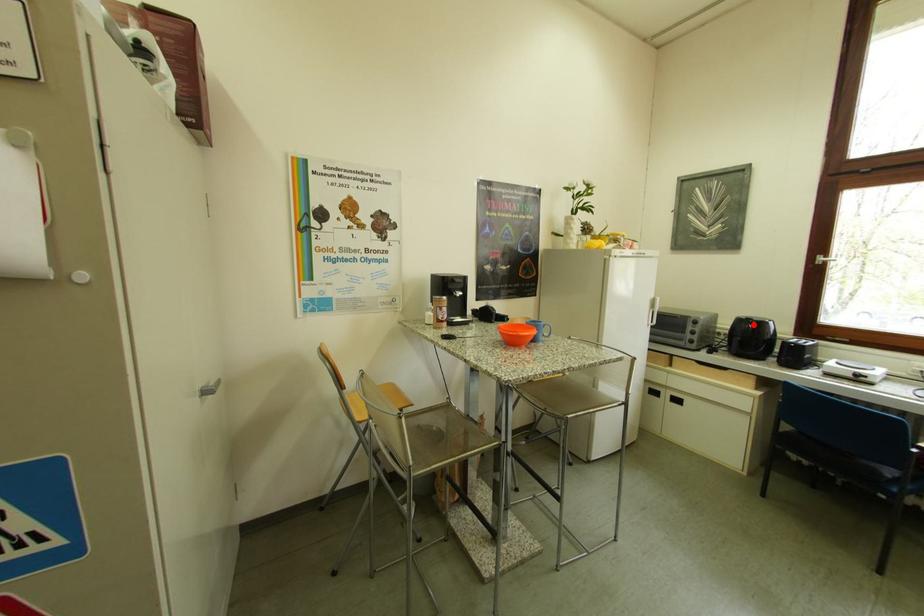
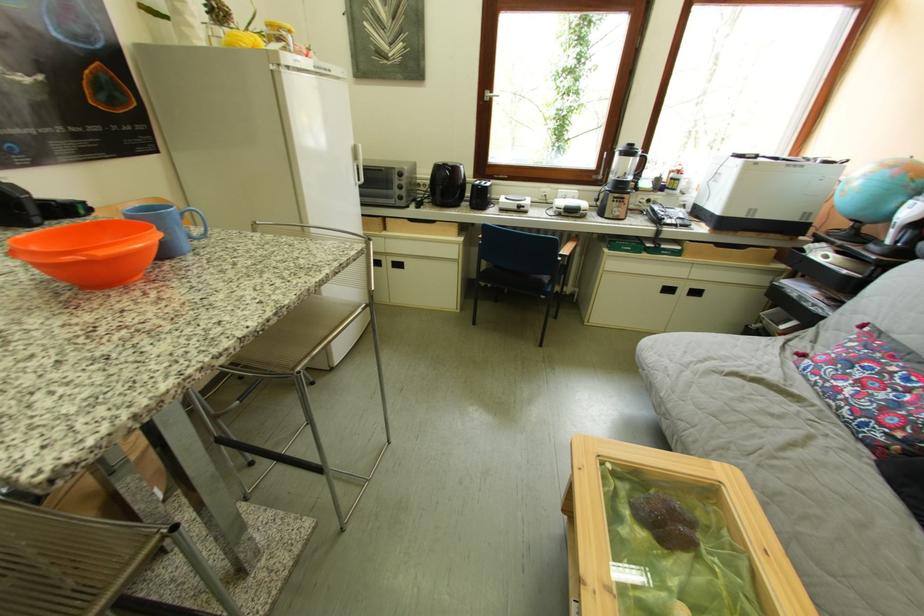
Question: I am providing you with two images of the same scene from different viewpoints. A red point is marked on the first image. Is the red point's position out of view in image 2?

Choices:
 (A) Yes
 (B) No

Answer: (B)